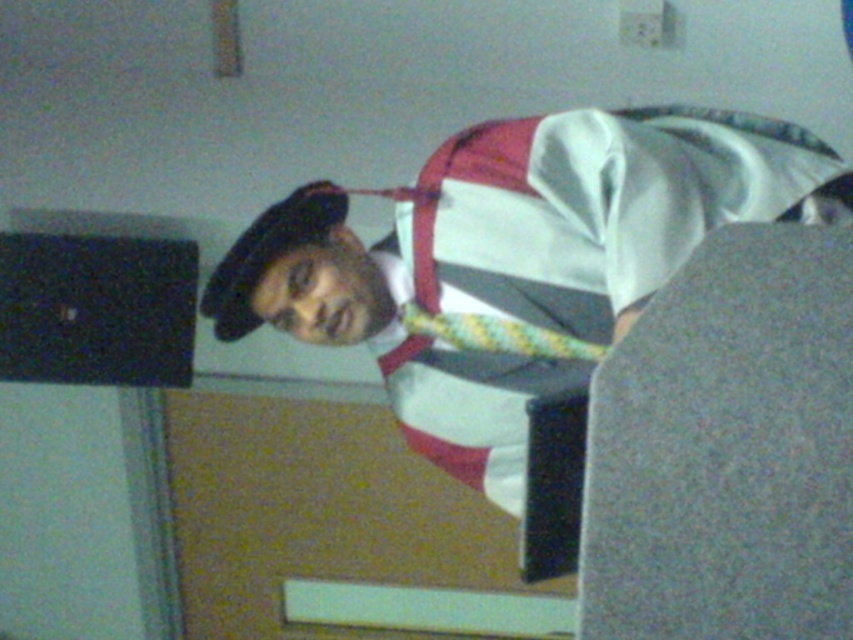
Question: Is white satin hat at upper left positioned before yellow-green textured tie at center?

Choices:
 (A) yes
 (B) no

Answer: (A)

Question: Which of the following is the farthest from the observer?

Choices:
 (A) white satin hat at upper left
 (B) yellow-green textured tie at center

Answer: (B)

Question: Considering the relative positions of white satin hat at upper left and yellow-green textured tie at center in the image provided, where is white satin hat at upper left located with respect to yellow-green textured tie at center?

Choices:
 (A) right
 (B) left

Answer: (A)

Question: Does white satin hat at upper left appear on the left side of yellow-green textured tie at center?

Choices:
 (A) no
 (B) yes

Answer: (A)